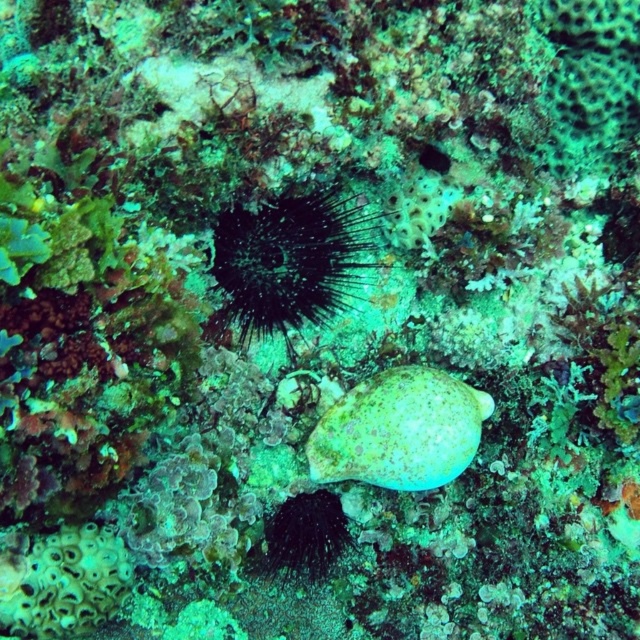
Can you confirm if dark spiny sea urchin at center is smaller than speckled green shell at center?

No.

Who is higher up, dark spiny sea urchin at center or speckled green shell at center?

Positioned higher is dark spiny sea urchin at center.

Find the location of a particular element. This screenshot has height=640, width=640. dark spiny sea urchin at center is located at coordinates (289, 260).

Locate an element on the screen. This screenshot has width=640, height=640. dark spiny sea urchin at center is located at coordinates (289, 260).